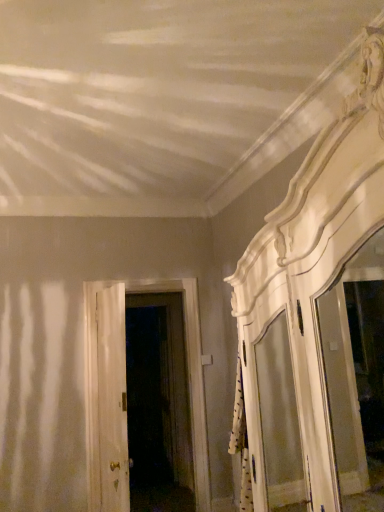
Locate an element on the screen. The image size is (384, 512). white wooden door at center, the second door positioned from the back is located at coordinates (112, 399).

This screenshot has width=384, height=512. Describe the element at coordinates (112, 399) in the screenshot. I see `white wooden door at center, placed as the first door when sorted from front to back` at that location.

This screenshot has height=512, width=384. Describe the element at coordinates (125, 388) in the screenshot. I see `white wooden door at center, the first door when ordered from back to front` at that location.

The width and height of the screenshot is (384, 512). I want to click on white wooden door at center, placed as the 2th door when sorted from front to back, so click(125, 388).

Locate an element on the screen. This screenshot has width=384, height=512. white wooden door at center, placed as the first door when sorted from front to back is located at coordinates (112, 399).

Based on their positions, is white wooden door at center, placed as the first door when sorted from front to back, located to the left or right of white wooden door at center, the first door when ordered from back to front?

white wooden door at center, placed as the first door when sorted from front to back, is to the left of white wooden door at center, the first door when ordered from back to front.

Considering the relative positions of white wooden door at center, the second door positioned from the back, and white wooden door at center, placed as the 2th door when sorted from front to back, in the image provided, is white wooden door at center, the second door positioned from the back, behind white wooden door at center, placed as the 2th door when sorted from front to back,?

No, the depth of white wooden door at center, the second door positioned from the back, is less than that of white wooden door at center, placed as the 2th door when sorted from front to back.

Is point (123, 486) positioned in front of point (115, 353)?

No, it is behind (115, 353).

From the image's perspective, is white wooden door at center, placed as the first door when sorted from front to back, on top of white wooden door at center, the first door when ordered from back to front?

Yes, from the image's perspective, white wooden door at center, placed as the first door when sorted from front to back, is on top of white wooden door at center, the first door when ordered from back to front.

From a real-world perspective, between white wooden door at center, placed as the first door when sorted from front to back, and white wooden door at center, placed as the 2th door when sorted from front to back, who is vertically higher?

From a 3D spatial view, white wooden door at center, placed as the first door when sorted from front to back, is above.

Based on the photo, considering the relative sizes of white wooden door at center, placed as the first door when sorted from front to back, and white wooden door at center, the first door when ordered from back to front, in the image provided, is white wooden door at center, placed as the first door when sorted from front to back, wider than white wooden door at center, the first door when ordered from back to front,?

No.

Considering the sizes of objects white wooden door at center, the second door positioned from the back, and white wooden door at center, placed as the 2th door when sorted from front to back, in the image provided, who is shorter, white wooden door at center, the second door positioned from the back, or white wooden door at center, placed as the 2th door when sorted from front to back,?

Standing shorter between the two is white wooden door at center, the second door positioned from the back.

Looking at this image, looking at the image, does white wooden door at center, the second door positioned from the back, seem bigger or smaller compared to white wooden door at center, the first door when ordered from back to front?

white wooden door at center, the second door positioned from the back, is smaller than white wooden door at center, the first door when ordered from back to front.

Is white wooden door at center, placed as the first door when sorted from front to back, located outside white wooden door at center, placed as the 2th door when sorted from front to back?

Yes, white wooden door at center, placed as the first door when sorted from front to back, is located beyond the bounds of white wooden door at center, placed as the 2th door when sorted from front to back.

Is white wooden door at center, the second door positioned from the back, far from white wooden door at center, placed as the 2th door when sorted from front to back?

white wooden door at center, the second door positioned from the back, is actually quite close to white wooden door at center, placed as the 2th door when sorted from front to back.

Based on the photo, is white wooden door at center, placed as the first door when sorted from front to back, turned away from white wooden door at center, placed as the 2th door when sorted from front to back?

white wooden door at center, placed as the first door when sorted from front to back, does not have its back to white wooden door at center, placed as the 2th door when sorted from front to back.

How distant is white wooden door at center, the second door positioned from the back, from white wooden door at center, the first door when ordered from back to front?

white wooden door at center, the second door positioned from the back, and white wooden door at center, the first door when ordered from back to front, are 9.21 inches apart.

The height and width of the screenshot is (512, 384). In order to click on door above the white wooden door at center, placed as the 2th door when sorted from front to back (from a real-world perspective) in this screenshot , I will do `click(112, 399)`.

Is white wooden door at center, the first door when ordered from back to front, to the left of white wooden door at center, placed as the first door when sorted from front to back, from the viewer's perspective?

Incorrect, white wooden door at center, the first door when ordered from back to front, is not on the left side of white wooden door at center, placed as the first door when sorted from front to back.

Between white wooden door at center, the first door when ordered from back to front, and white wooden door at center, placed as the first door when sorted from front to back, which one is positioned behind?

white wooden door at center, the first door when ordered from back to front, is behind.

Is point (188, 316) closer or farther from the camera than point (113, 305)?

Point (188, 316).

From the image's perspective, is white wooden door at center, placed as the 2th door when sorted from front to back, on top of white wooden door at center, placed as the first door when sorted from front to back?

Actually, white wooden door at center, placed as the 2th door when sorted from front to back, appears below white wooden door at center, placed as the first door when sorted from front to back, in the image.

From a real-world perspective, is white wooden door at center, placed as the 2th door when sorted from front to back, positioned above or below white wooden door at center, placed as the first door when sorted from front to back?

In terms of real-world spatial position, white wooden door at center, placed as the 2th door when sorted from front to back, is below white wooden door at center, placed as the first door when sorted from front to back.

Considering the relative sizes of white wooden door at center, the first door when ordered from back to front, and white wooden door at center, the second door positioned from the back, in the image provided, is white wooden door at center, the first door when ordered from back to front, wider than white wooden door at center, the second door positioned from the back,?

Correct, the width of white wooden door at center, the first door when ordered from back to front, exceeds that of white wooden door at center, the second door positioned from the back.

Is white wooden door at center, placed as the 2th door when sorted from front to back, taller than white wooden door at center, the second door positioned from the back?

Yes, white wooden door at center, placed as the 2th door when sorted from front to back, is taller than white wooden door at center, the second door positioned from the back.

Which of these two, white wooden door at center, placed as the 2th door when sorted from front to back, or white wooden door at center, placed as the first door when sorted from front to back, is smaller?

white wooden door at center, placed as the first door when sorted from front to back.

Is white wooden door at center, the first door when ordered from back to front, not inside white wooden door at center, placed as the first door when sorted from front to back?

Yes.

Is white wooden door at center, the first door when ordered from back to front, placed right next to white wooden door at center, the second door positioned from the back?

No, white wooden door at center, the first door when ordered from back to front, is not touching white wooden door at center, the second door positioned from the back.

Is white wooden door at center, placed as the 2th door when sorted from front to back, looking in the opposite direction of white wooden door at center, the second door positioned from the back?

No, white wooden door at center, placed as the 2th door when sorted from front to back,'s orientation is not away from white wooden door at center, the second door positioned from the back.

How many degrees apart are the facing directions of white wooden door at center, placed as the 2th door when sorted from front to back, and white wooden door at center, placed as the first door when sorted from front to back?

The angle between the facing direction of white wooden door at center, placed as the 2th door when sorted from front to back, and the facing direction of white wooden door at center, placed as the first door when sorted from front to back, is 97.9 degrees.

At what (x,y) coordinates should I click in order to perform the action: click on door behind the white wooden door at center, the second door positioned from the back. Please return your answer as a coordinate pair (x, y). Looking at the image, I should click on (125, 388).

I want to click on door below the white wooden door at center, the second door positioned from the back (from a real-world perspective), so click(125, 388).

The height and width of the screenshot is (512, 384). In order to click on door located behind the white wooden door at center, placed as the first door when sorted from front to back in this screenshot , I will do `click(125, 388)`.